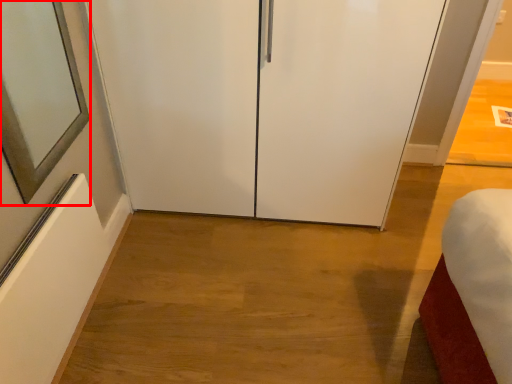
Question: Considering the relative positions of mirror (annotated by the red box) and glass door in the image provided, where is mirror (annotated by the red box) located with respect to the staircase?

Choices:
 (A) left
 (B) right

Answer: (A)